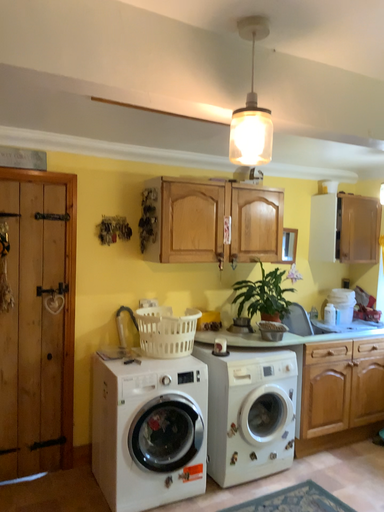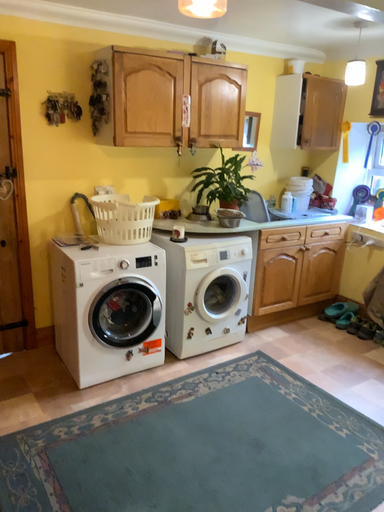
Question: Which way did the camera rotate in the video?

Choices:
 (A) rotated upward
 (B) rotated downward

Answer: (B)